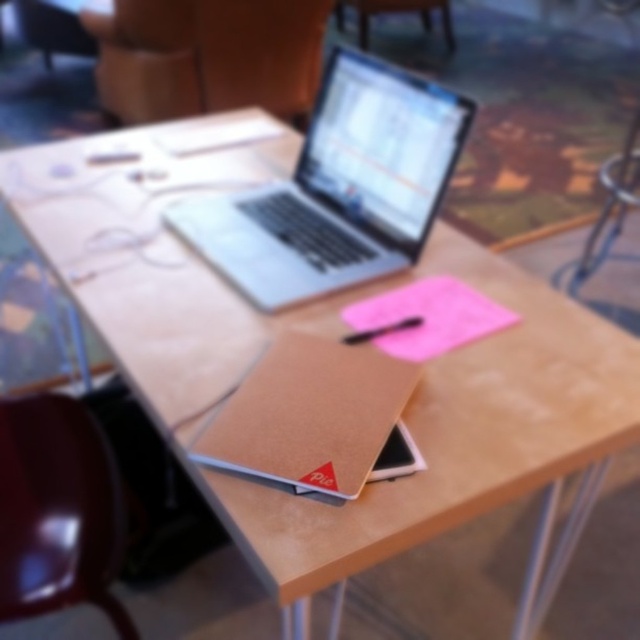
You are organizing the workspace on the wooden table. You need to move the silver metallic laptop at center so that it is no longer below the matte brown chair at upper center. Which direction should you move it?

The silver metallic laptop at center is located below the matte brown chair at upper center. To move it so it is no longer below, you should move it upwards away from the chair.

You are organizing a meeting and need to place a 30 cm long presentation binder between the matte brown chair at upper center and the black matte pen at center on the table. Can the binder fit in the space between them?

The matte brown chair at upper center is further to the viewer than the black matte pen at center, so the space between them is at least 30 cm. Therefore, the binder can fit between the matte brown chair at upper center and the black matte pen at center.